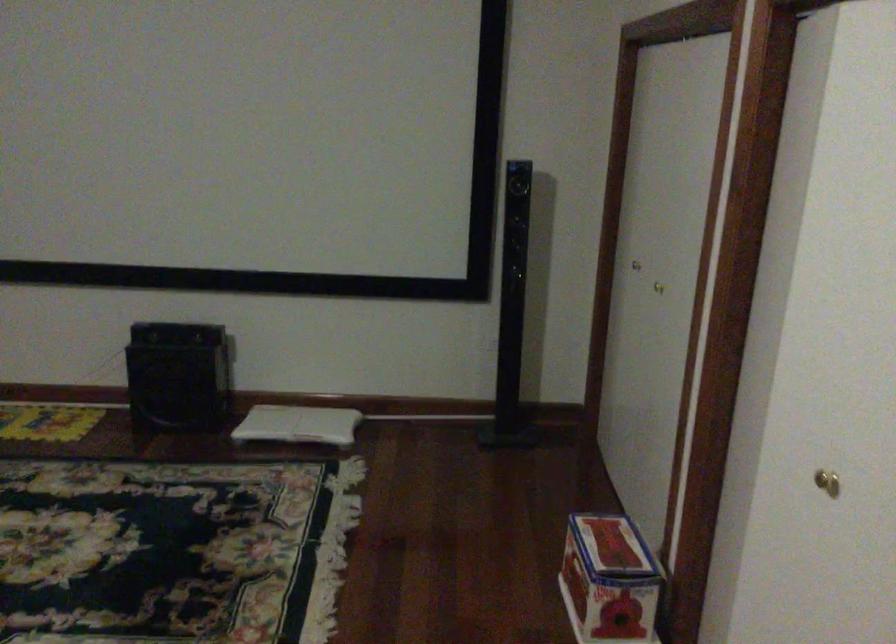
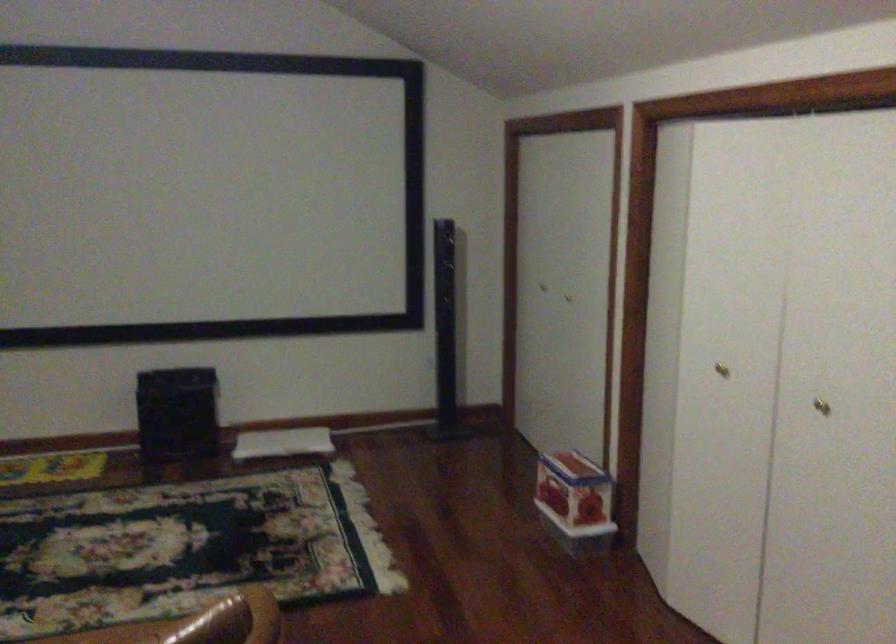
The point at (822, 467) is marked in the first image. Where is the corresponding point in the second image?

(721, 368)